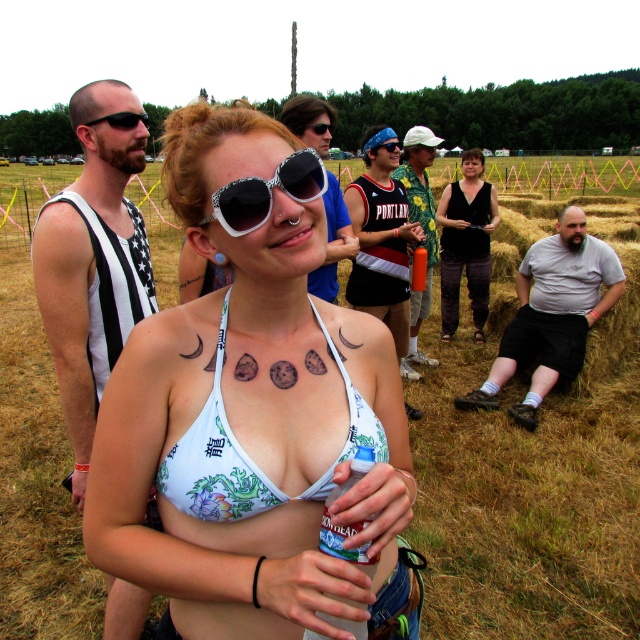
Is white printed bikini top at center shorter than white striped tank top at left?

Yes, white printed bikini top at center is shorter than white striped tank top at left.

Can you confirm if white printed bikini top at center is thinner than white striped tank top at left?

Yes.

You are a GUI agent. You are given a task and a screenshot of the screen. Output one action in this format:
    pyautogui.click(x=<x>, y=<y>)
    Task: Click on the white printed bikini top at center
    The width and height of the screenshot is (640, 640).
    Given the screenshot: What is the action you would take?
    pyautogui.click(x=250, y=406)

From the picture: Does orange matte water bottle at center appear on the left side of white plastic goggles at center?

No, orange matte water bottle at center is not to the left of white plastic goggles at center.

Does orange matte water bottle at center appear over white plastic goggles at center?

Indeed, orange matte water bottle at center is positioned over white plastic goggles at center.

Where is `orange matte water bottle at center`? This screenshot has height=640, width=640. orange matte water bottle at center is located at coordinates (422, 228).

Which is behind, point (112, 202) or point (228, 451)?

Positioned behind is point (112, 202).

Measure the distance between point (152, 301) and camera.

Point (152, 301) and camera are 7.54 feet apart from each other.

The height and width of the screenshot is (640, 640). What are the coordinates of `white striped tank top at left` in the screenshot? It's located at (92, 262).